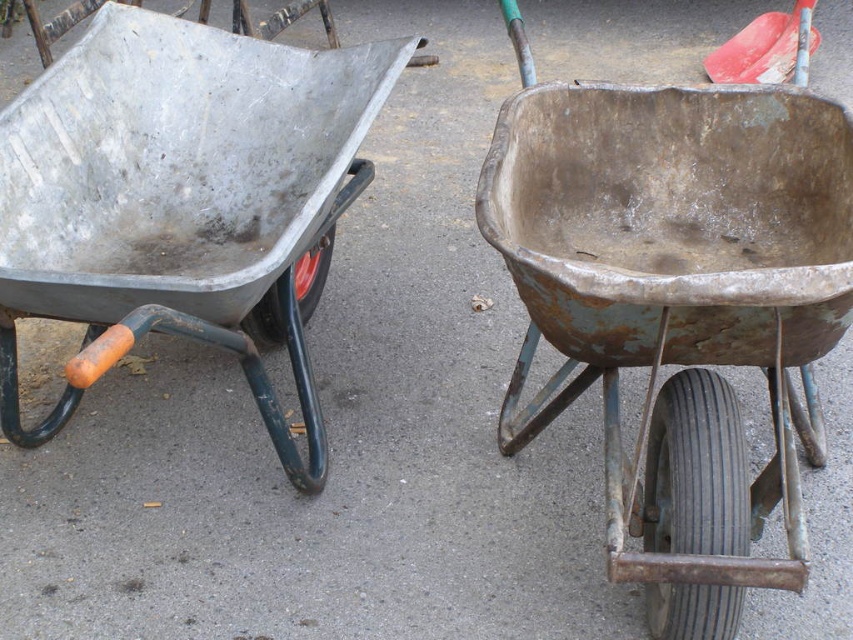
You are standing in front of two wheelbarrows placed side by side on a paved surface. You notice two points marked on the ground at coordinates point [90,314] and point [726,51]. Which point is closer to you?

Point [90,314] is closer to the camera than point [726,51], so the point closer to you is point [90,314].

You are a construction worker trying to move materials from the rusty metal wheelbarrow at center to the metallic gray wheelbarrow at left. Since both are wheelbarrows, which one is closer to you?

The metallic gray wheelbarrow at left is closer to you because it is positioned above the rusty metal wheelbarrow at center, meaning it is nearer in the visual perspective.